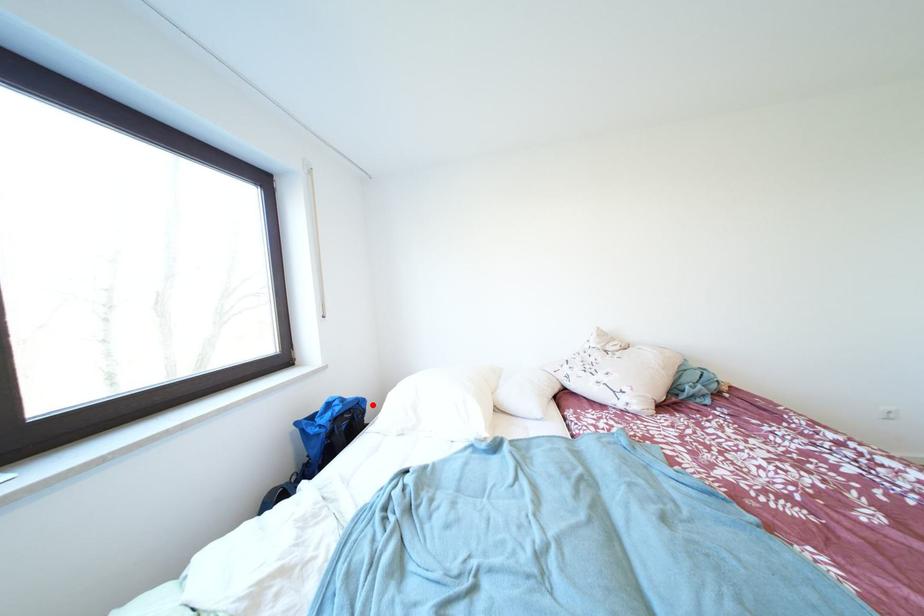
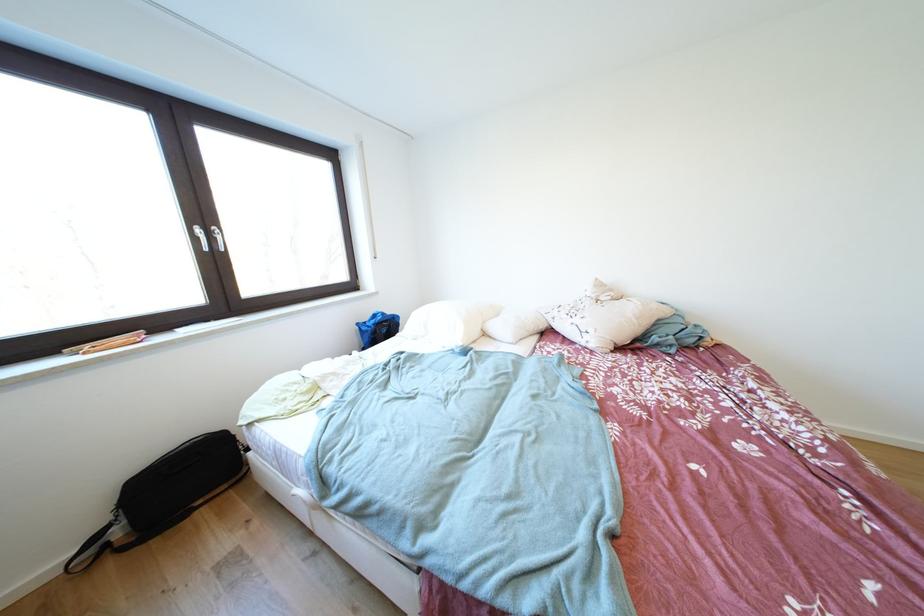
Question: I am providing you with two images of the same scene from different viewpoints. In image1, a red point is highlighted. Considering the same 3D point in image2, which of the following is correct?

Choices:
 (A) It is closer
 (B) It is farther

Answer: (A)